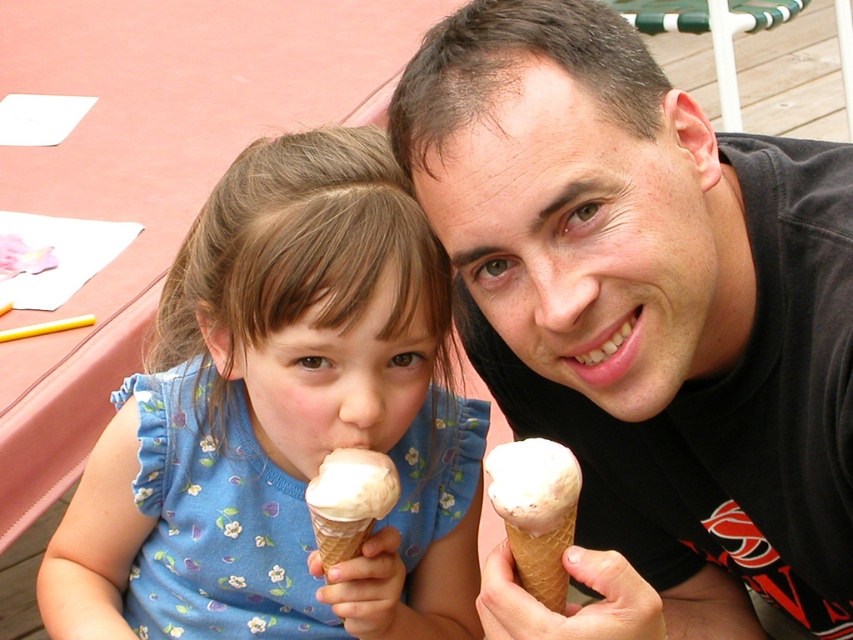
Question: Is blue floral dress at center further to the viewer compared to vanilla ice cream in waffle cone at lower center?

Choices:
 (A) no
 (B) yes

Answer: (B)

Question: Which point is farther to the camera?

Choices:
 (A) pyautogui.click(x=355, y=525)
 (B) pyautogui.click(x=492, y=500)
 (C) pyautogui.click(x=289, y=269)

Answer: (A)

Question: Does blue floral dress at center have a smaller size compared to vanilla ice cream in waffle cone at right?

Choices:
 (A) no
 (B) yes

Answer: (A)

Question: From the image, what is the correct spatial relationship of matte black ice cream cone at center in relation to vanilla ice cream in waffle cone at right?

Choices:
 (A) above
 (B) below

Answer: (A)

Question: Which object is the closest to the matte black ice cream cone at center?

Choices:
 (A) blue floral dress at center
 (B) vanilla ice cream in waffle cone at lower center
 (C) vanilla ice cream in waffle cone at right

Answer: (A)

Question: Which point appears farthest from the camera in this image?

Choices:
 (A) (320, 524)
 (B) (515, 499)

Answer: (A)